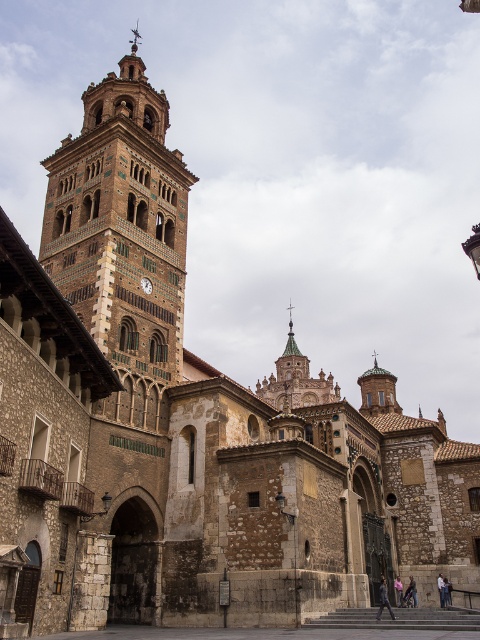
You are an architect planning to install a new decorative element on the building. You have two options to choose from. The first option is a decorative element that is the same size as the terracotta brick tower at left. The second option is a decorative element that is the same size as the matte brown clock at upper left. Which decorative element would you choose if you want the one that is wider?

You should choose the decorative element that is the same size as the terracotta brick tower at left because it is wider than the matte brown clock at upper left.

You are standing at the entrance of the historic building and want to take a photo of the terracotta brick tower at left. Based on its position, which direction should you face to capture it in your shot?

The terracotta brick tower at left is located at point (x=122, y=236), which corresponds to the left side of the image. Therefore, you should face towards the left side of the building to capture the terracotta brick tower at left in your photo.

You are standing in front of the historic building and want to take a photo of both the terracotta brick tower at left and the golden ornate spire at center. Which direction should you face to ensure both are visible in your frame?

You should face towards the center of the building to capture both the terracotta brick tower at left and the golden ornate spire at center in your frame since the terracotta brick tower at left is positioned to the left of the golden ornate spire at center.